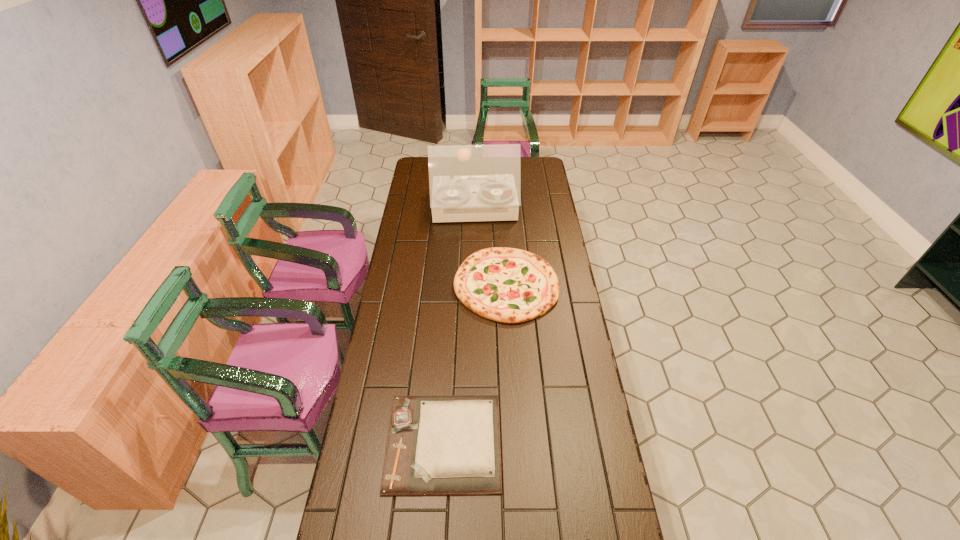
What are the coordinates of `vacant area that satisfies the following two spatial constraints: 1. on the back side of the clipboard; 2. on the left side of the tallest object` in the screenshot? It's located at (458, 209).